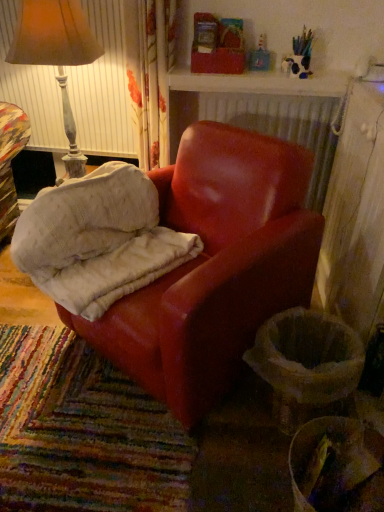
Question: In the image, is matte brown lampshade at upper left positioned in front of or behind suede-like red armchair at center?

Choices:
 (A) behind
 (B) front

Answer: (A)

Question: From the image's perspective, is matte brown lampshade at upper left above or below suede-like red armchair at center?

Choices:
 (A) below
 (B) above

Answer: (B)

Question: Based on their relative distances, which object is farther from the suede-like red armchair at center?

Choices:
 (A) matte leather chair at center
 (B) matte brown lampshade at upper left

Answer: (B)

Question: Which object is the farthest from the matte leather chair at center?

Choices:
 (A) suede-like red armchair at center
 (B) matte brown lampshade at upper left

Answer: (B)